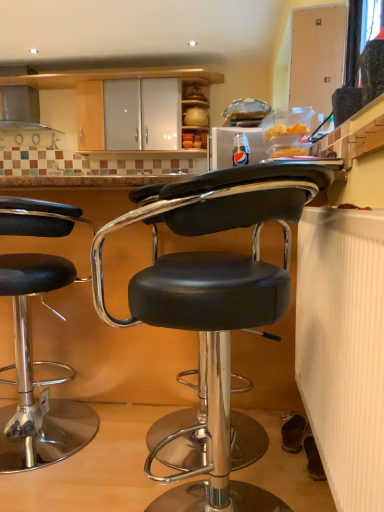
Question: Can you confirm if black leather stool at center, the 2th chair positioned from the back, is positioned to the left of satin silver exhaust hood at upper left?

Choices:
 (A) no
 (B) yes

Answer: (A)

Question: Does black leather stool at center, which is the 2th chair from left to right, have a smaller size compared to satin silver exhaust hood at upper left?

Choices:
 (A) no
 (B) yes

Answer: (A)

Question: From the image's perspective, is black leather stool at center, which is the 1th chair in right-to-left order, on satin silver exhaust hood at upper left?

Choices:
 (A) no
 (B) yes

Answer: (A)

Question: Is black leather stool at center, which is the 1th chair in right-to-left order, further to the viewer compared to satin silver exhaust hood at upper left?

Choices:
 (A) yes
 (B) no

Answer: (B)

Question: Can you confirm if black leather stool at center, which is the 1th chair in right-to-left order, is shorter than satin silver exhaust hood at upper left?

Choices:
 (A) yes
 (B) no

Answer: (B)

Question: Would you say black leather stool at center, which is the 2th chair from left to right, is inside or outside satin silver exhaust hood at upper left?

Choices:
 (A) outside
 (B) inside

Answer: (A)

Question: Considering their positions, is black leather stool at center, which is the 2th chair from left to right, located in front of or behind satin silver exhaust hood at upper left?

Choices:
 (A) front
 (B) behind

Answer: (A)

Question: Looking at their shapes, would you say black leather stool at center, which is the 1th chair in right-to-left order, is wider or thinner than satin silver exhaust hood at upper left?

Choices:
 (A) thin
 (B) wide

Answer: (B)

Question: Considering the positions of point (266, 166) and point (1, 103), is point (266, 166) closer or farther from the camera than point (1, 103)?

Choices:
 (A) farther
 (B) closer

Answer: (B)

Question: Considering the positions of point (6, 103) and point (216, 315), is point (6, 103) closer or farther from the camera than point (216, 315)?

Choices:
 (A) closer
 (B) farther

Answer: (B)

Question: Based on their positions, is satin silver exhaust hood at upper left located to the left or right of black leather stool at center, the 2th chair positioned from the back?

Choices:
 (A) left
 (B) right

Answer: (A)

Question: Relative to black leather stool at center, which is the 1th chair in right-to-left order, is satin silver exhaust hood at upper left in front or behind?

Choices:
 (A) behind
 (B) front

Answer: (A)

Question: From a real-world perspective, relative to black leather stool at center, which is the 1th chair in right-to-left order, is satin silver exhaust hood at upper left vertically above or below?

Choices:
 (A) above
 (B) below

Answer: (A)

Question: Does point (59, 278) appear closer or farther from the camera than point (18, 119)?

Choices:
 (A) closer
 (B) farther

Answer: (A)

Question: Looking at their shapes, would you say black leather stool at left, which is the 1th chair in back-to-front order, is wider or thinner than satin silver exhaust hood at upper left?

Choices:
 (A) wide
 (B) thin

Answer: (A)